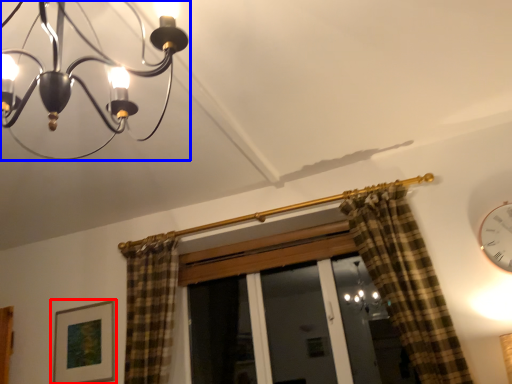
Question: Which of the following is the farthest to the observer, picture frame (highlighted by a red box) or lamp (highlighted by a blue box)?

Choices:
 (A) picture frame
 (B) lamp

Answer: (A)